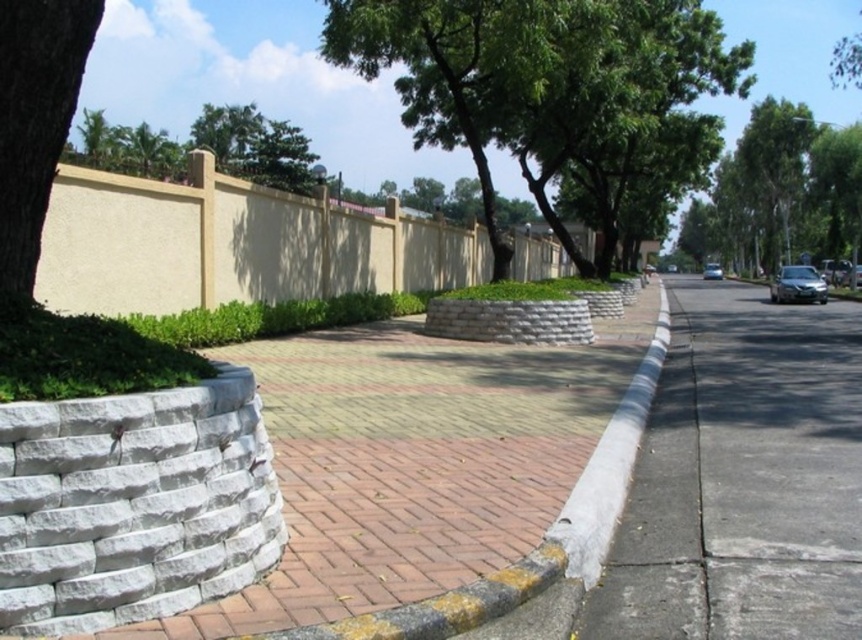
You are a delivery person trying to park your 1.8 meters tall delivery box next to the satin silver sedan at right. Considering the space available between the sidewalk and the green leafy tree at center, will the tree block the box from being placed there?

The green leafy tree at center is taller than the satin silver sedan at right. Since the tree is taller, it may cast a shadow or have a larger canopy, but the height of the delivery box is only 1.8 meters. The tree height comparison does not directly affect the vertical space needed for the box. However, the horizontal space between the sidewalk and the tree must be considered. Since the description does not provide information about the horizontal distance, it is unclear if the tree will block the box. The

Consider the image. You are a delivery person trying to navigate a narrow sidewalk. You see the gray concrete sidewalk at center and the green leafy tree at upper center. Which one is narrower in width?

The gray concrete sidewalk at center is thinner than the green leafy tree at upper center in width.

You are standing at the point with coordinates point (803,266) and want to walk to the point with coordinates point (536,93). Which direction should you face to move towards your destination?

You should face towards the direction opposite of point (803,266) because point (536,93) is in front of it.